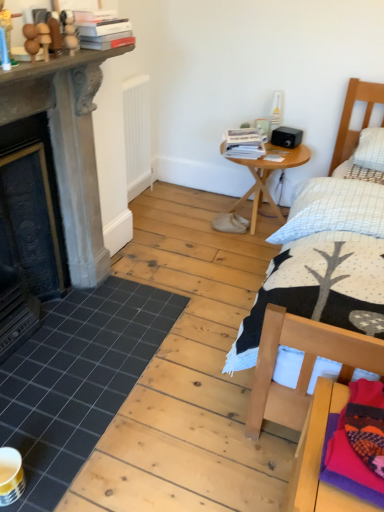
At what (x,y) coordinates should I click in order to perform the action: click on vacant area on top of black tile at lower left (from a real-world perspective). Please return your answer as a coordinate pair (x, y). Looking at the image, I should click on (71, 354).